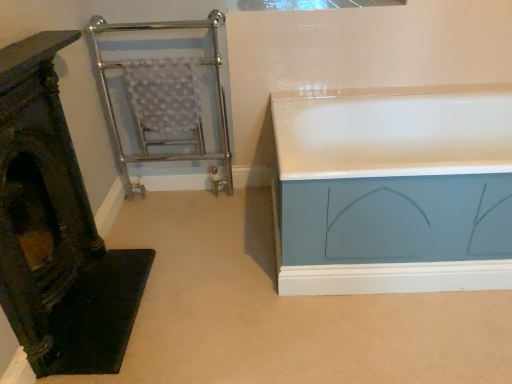
I want to click on free region under chrome/metal towel rack at left (from a real-world perspective), so [178, 185].